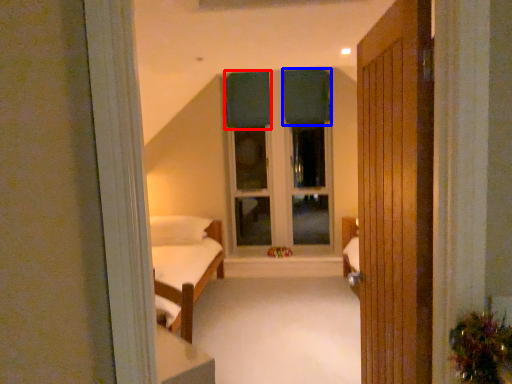
Question: Which object is further to the camera taking this photo, curtain (highlighted by a red box) or curtain (highlighted by a blue box)?

Choices:
 (A) curtain
 (B) curtain

Answer: (A)